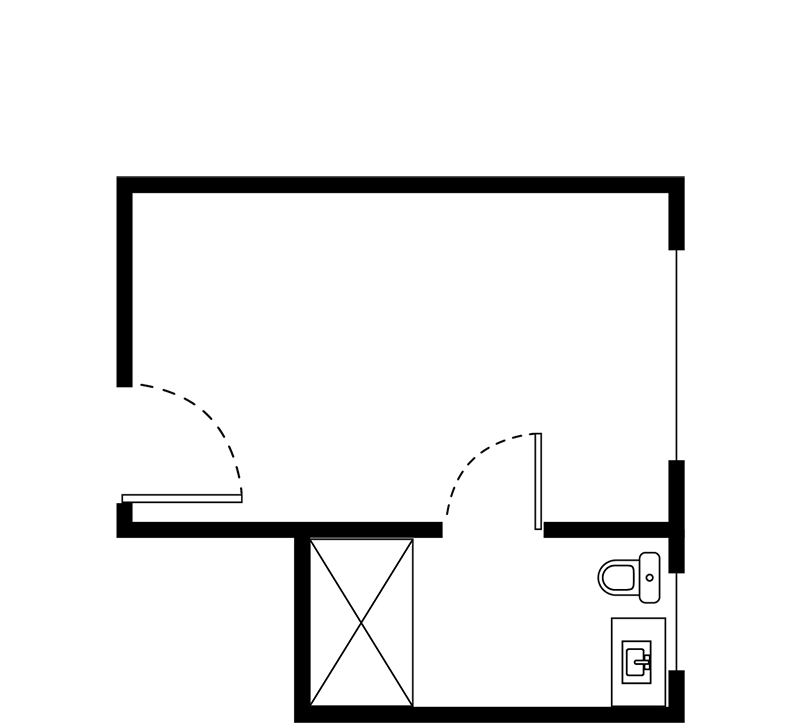
Image resolution: width=800 pixels, height=723 pixels. I want to click on vanity counter, so click(x=637, y=630).